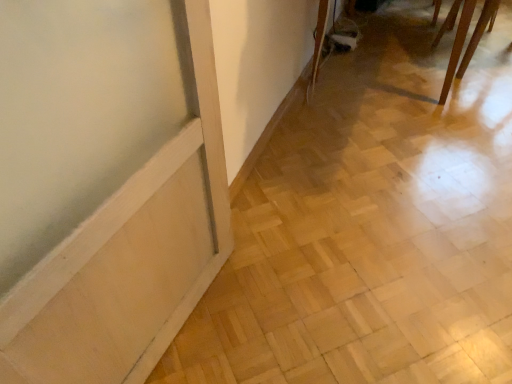
Question: Is wooden dining table at upper right facing towards light wood parquet floor at lower left?

Choices:
 (A) no
 (B) yes

Answer: (A)

Question: From the image's perspective, is wooden dining table at upper right below light wood parquet floor at lower left?

Choices:
 (A) yes
 (B) no

Answer: (B)

Question: From a real-world perspective, is wooden dining table at upper right over light wood parquet floor at lower left?

Choices:
 (A) yes
 (B) no

Answer: (A)

Question: Is wooden dining table at upper right smaller than light wood parquet floor at lower left?

Choices:
 (A) yes
 (B) no

Answer: (B)

Question: Is the position of wooden dining table at upper right less distant than that of light wood parquet floor at lower left?

Choices:
 (A) yes
 (B) no

Answer: (B)

Question: Does wooden dining table at upper right come behind light wood parquet floor at lower left?

Choices:
 (A) no
 (B) yes

Answer: (B)

Question: From a real-world perspective, is light wood parquet floor at lower left physically above wooden dining table at upper right?

Choices:
 (A) yes
 (B) no

Answer: (B)

Question: From a real-world perspective, is light wood parquet floor at lower left under wooden dining table at upper right?

Choices:
 (A) yes
 (B) no

Answer: (A)

Question: Does light wood parquet floor at lower left have a smaller size compared to wooden dining table at upper right?

Choices:
 (A) no
 (B) yes

Answer: (B)

Question: Is light wood parquet floor at lower left positioned behind wooden dining table at upper right?

Choices:
 (A) yes
 (B) no

Answer: (B)

Question: Is light wood parquet floor at lower left outside wooden dining table at upper right?

Choices:
 (A) yes
 (B) no

Answer: (A)

Question: Is light wood parquet floor at lower left bigger than wooden dining table at upper right?

Choices:
 (A) yes
 (B) no

Answer: (B)

Question: In terms of width, does light wood parquet floor at lower left look wider or thinner when compared to wooden dining table at upper right?

Choices:
 (A) wide
 (B) thin

Answer: (A)